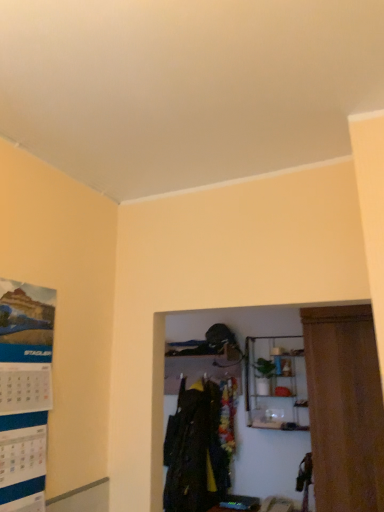
What is the approximate height of dark green fabric coat at center?

dark green fabric coat at center is 37.64 inches in height.

Find the location of `dark green fabric coat at center`. dark green fabric coat at center is located at coordinates (195, 451).

This screenshot has height=512, width=384. What do you see at coordinates (276, 385) in the screenshot?
I see `metallic wire shelf at upper center` at bounding box center [276, 385].

Where is `dark green fabric coat at center`? dark green fabric coat at center is located at coordinates (195, 451).

What's the angular difference between matte paper poster at left and metallic wire shelf at upper center's facing directions?

The angular difference between matte paper poster at left and metallic wire shelf at upper center is 89.3 degrees.

In the scene shown: Is matte paper poster at left placed right next to metallic wire shelf at upper center?

There is a gap between matte paper poster at left and metallic wire shelf at upper center.

From a real-world perspective, is matte paper poster at left beneath metallic wire shelf at upper center?

No, from a real-world perspective, matte paper poster at left is not below metallic wire shelf at upper center.

Between matte paper poster at left and metallic wire shelf at upper center, which one has larger width?

metallic wire shelf at upper center.

Considering the relative positions of dark green fabric coat at center and metallic wire shelf at upper center in the image provided, is dark green fabric coat at center behind metallic wire shelf at upper center?

Yes, the depth of dark green fabric coat at center is greater than that of metallic wire shelf at upper center.

Is dark green fabric coat at center not inside metallic wire shelf at upper center?

dark green fabric coat at center lies outside metallic wire shelf at upper center's area.

From a real-world perspective, which object rests below the other?

From a 3D spatial view, dark green fabric coat at center is below.

From the picture: Considering the sizes of matte paper poster at left and dark green fabric coat at center in the image, is matte paper poster at left taller or shorter than dark green fabric coat at center?

Clearly, matte paper poster at left is shorter compared to dark green fabric coat at center.

Could dark green fabric coat at center be considered to be inside matte paper poster at left?

That's incorrect, dark green fabric coat at center is not inside matte paper poster at left.

Would you consider matte paper poster at left to be distant from dark green fabric coat at center?

Yes, matte paper poster at left and dark green fabric coat at center are located far from each other.

How distant is matte paper poster at left from dark green fabric coat at center?

matte paper poster at left is 6.13 feet away from dark green fabric coat at center.

What's the angular difference between dark green fabric coat at center and matte paper poster at left's facing directions?

The angular difference between dark green fabric coat at center and matte paper poster at left is 89.3 degrees.

Is point (199, 426) less distant than point (15, 468)?

That is False.

Is matte paper poster at left inside dark green fabric coat at center?

No, dark green fabric coat at center does not contain matte paper poster at left.

From the image's perspective, which one is positioned lower, dark green fabric coat at center or matte paper poster at left?

From the image's view, dark green fabric coat at center is below.

From their relative heights in the image, would you say metallic wire shelf at upper center is taller or shorter than matte paper poster at left?

Considering their sizes, metallic wire shelf at upper center has less height than matte paper poster at left.

How different are the orientations of metallic wire shelf at upper center and matte paper poster at left in degrees?

89.3 degrees separate the facing orientations of metallic wire shelf at upper center and matte paper poster at left.

Is metallic wire shelf at upper center far from matte paper poster at left?

Yes, metallic wire shelf at upper center and matte paper poster at left are located far from each other.

Does metallic wire shelf at upper center come behind matte paper poster at left?

Yes, the depth of metallic wire shelf at upper center is greater than that of matte paper poster at left.

From the image's perspective, between metallic wire shelf at upper center and dark green fabric coat at center, which one is located above?

metallic wire shelf at upper center is shown above in the image.

Is metallic wire shelf at upper center positioned with its back to dark green fabric coat at center?

That's not correct — metallic wire shelf at upper center is not looking away from dark green fabric coat at center.

Is metallic wire shelf at upper center closer to camera compared to dark green fabric coat at center?

Yes, it is in front of dark green fabric coat at center.

There is a metallic wire shelf at upper center. Where is `poster page above it (from a real-world perspective)`? poster page above it (from a real-world perspective) is located at coordinates (24, 393).

Locate an element on the screen. The width and height of the screenshot is (384, 512). shelf in front of the dark green fabric coat at center is located at coordinates (276, 385).

Based on the photo, which object lies nearer to the anchor point dark green fabric coat at center, metallic wire shelf at upper center or matte paper poster at left?

metallic wire shelf at upper center is closer to dark green fabric coat at center.

Considering their positions, is dark green fabric coat at center positioned closer to matte paper poster at left than metallic wire shelf at upper center?

dark green fabric coat at center is positioned closer to the anchor matte paper poster at left.

When comparing their distances from dark green fabric coat at center, does matte paper poster at left or metallic wire shelf at upper center seem further?

Among the two, matte paper poster at left is located further to dark green fabric coat at center.

From the image, which object appears to be farther from metallic wire shelf at upper center, matte paper poster at left or dark green fabric coat at center?

matte paper poster at left is further to metallic wire shelf at upper center.

Looking at the image, which one is located further to matte paper poster at left, metallic wire shelf at upper center or dark green fabric coat at center?

metallic wire shelf at upper center is further to matte paper poster at left.

When comparing their distances from metallic wire shelf at upper center, does dark green fabric coat at center or matte paper poster at left seem further?

matte paper poster at left is positioned further to the anchor metallic wire shelf at upper center.

Where is `shelf between matte paper poster at left and dark green fabric coat at center from front to back`? shelf between matte paper poster at left and dark green fabric coat at center from front to back is located at coordinates (276, 385).